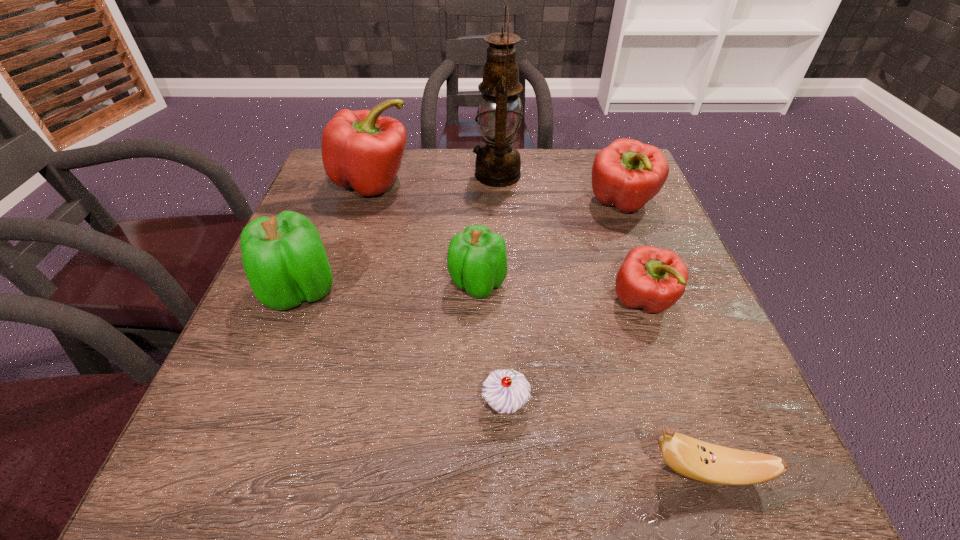
Where is `oil lamp that is at the far edge`? The width and height of the screenshot is (960, 540). oil lamp that is at the far edge is located at coordinates (498, 164).

Locate an element on the screen. object that is at the near edge is located at coordinates (692, 458).

Where is `banana that is positioned at the right edge`? The width and height of the screenshot is (960, 540). banana that is positioned at the right edge is located at coordinates (692, 458).

Locate an element on the screen. object present at the far left corner is located at coordinates (360, 149).

Locate an element on the screen. The width and height of the screenshot is (960, 540). object that is positioned at the far right corner is located at coordinates (627, 174).

You are a GUI agent. You are given a task and a screenshot of the screen. Output one action in this format:
    pyautogui.click(x=<x>, y=<y>)
    Task: Click on the object that is positioned at the near right corner
    The image size is (960, 540).
    Given the screenshot: What is the action you would take?
    pyautogui.click(x=692, y=458)

This screenshot has height=540, width=960. Find the location of `free space at the far edge of the desktop`. free space at the far edge of the desktop is located at coordinates (411, 171).

The width and height of the screenshot is (960, 540). Identify the location of blank space at the right edge of the desktop. (598, 228).

This screenshot has height=540, width=960. I want to click on vacant space at the far right corner of the desktop, so click(x=577, y=157).

Where is `vacant position at the near right corner of the desktop`? This screenshot has height=540, width=960. vacant position at the near right corner of the desktop is located at coordinates (706, 436).